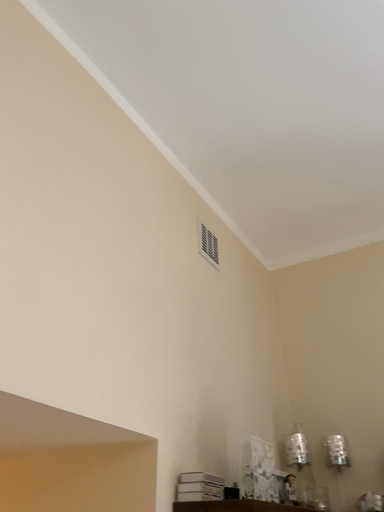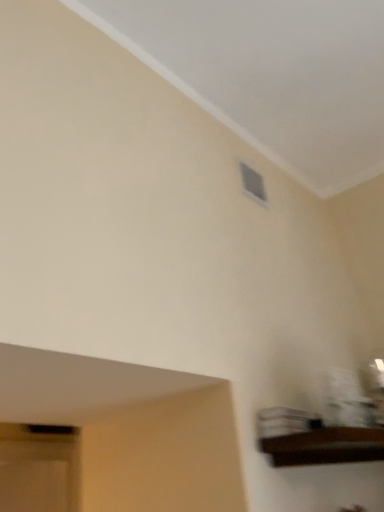
Question: Which way did the camera rotate in the video?

Choices:
 (A) rotated left
 (B) rotated right

Answer: (A)